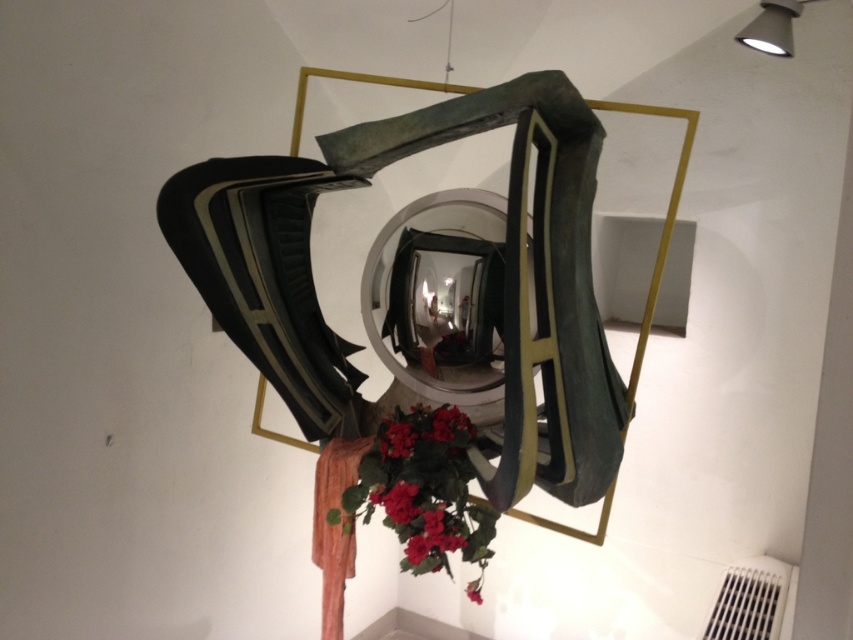
Question: In this image, where is matte red flowers at lower center located relative to white plastic radiator at lower right?

Choices:
 (A) left
 (B) right

Answer: (A)

Question: Does shiny metallic mirror at center appear on the left side of matte red flower at lower center?

Choices:
 (A) yes
 (B) no

Answer: (A)

Question: Which object is the closest to the white plastic radiator at lower right?

Choices:
 (A) shiny metallic mirror at center
 (B) red matte flower at center

Answer: (A)

Question: Estimate the real-world distances between objects in this image. Which object is farther from the red matte flower at center?

Choices:
 (A) matte red flower at lower center
 (B) white plastic radiator at lower right
 (C) shiny metallic mirror at center
 (D) vibrant matte red flowers at center

Answer: (B)

Question: Is shiny metallic mirror at center below red matte flower at center?

Choices:
 (A) no
 (B) yes

Answer: (A)

Question: Which point is farther from the camera taking this photo?

Choices:
 (A) pos(399,429)
 (B) pos(386,508)
 (C) pos(399,500)
 (D) pos(471,385)

Answer: (D)